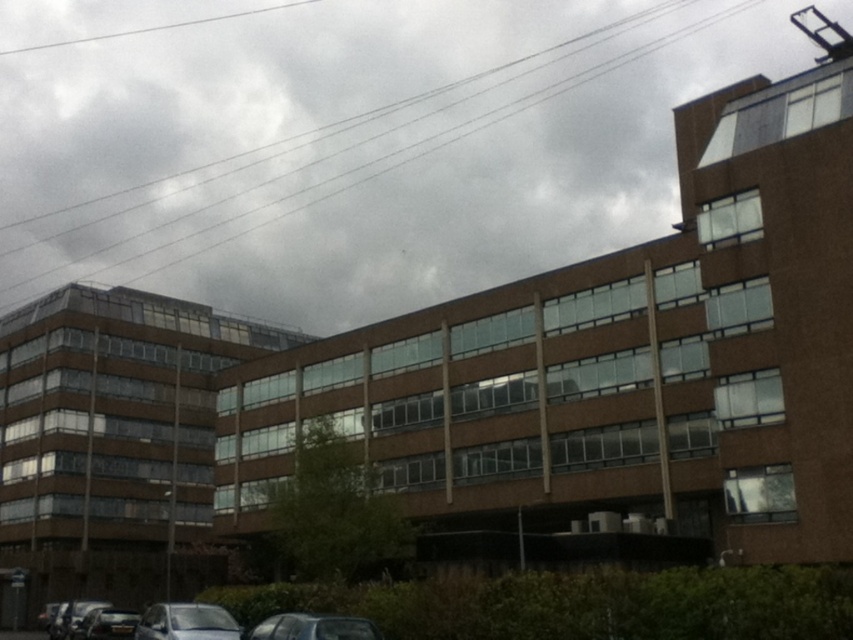
Question: From the image, what is the correct spatial relationship of metallic silver car at lower center in relation to shiny silver car at lower left?

Choices:
 (A) left
 (B) right

Answer: (B)

Question: In this image, where is metallic silver car at lower center located relative to shiny silver car at lower left?

Choices:
 (A) right
 (B) left

Answer: (A)

Question: Is metallic silver car at lower left to the left of metallic silver car at lower center from the viewer's perspective?

Choices:
 (A) no
 (B) yes

Answer: (B)

Question: Which object is the farthest from the metallic silver car at lower center?

Choices:
 (A) metallic silver car at lower left
 (B) shiny silver car at lower left

Answer: (B)

Question: Which point appears farthest from the camera in this image?

Choices:
 (A) (280, 625)
 (B) (225, 630)
 (C) (103, 620)

Answer: (C)

Question: Based on their relative distances, which object is farther from the metallic silver car at lower center?

Choices:
 (A) shiny silver car at lower left
 (B) metallic silver car at lower left

Answer: (A)